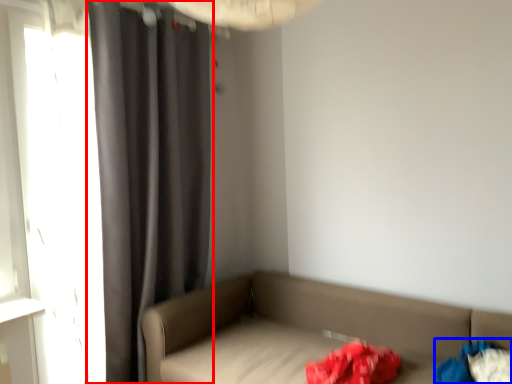
Question: Which object appears closest to the camera in this image, curtain (highlighted by a red box) or clothing (highlighted by a blue box)?

Choices:
 (A) curtain
 (B) clothing

Answer: (B)